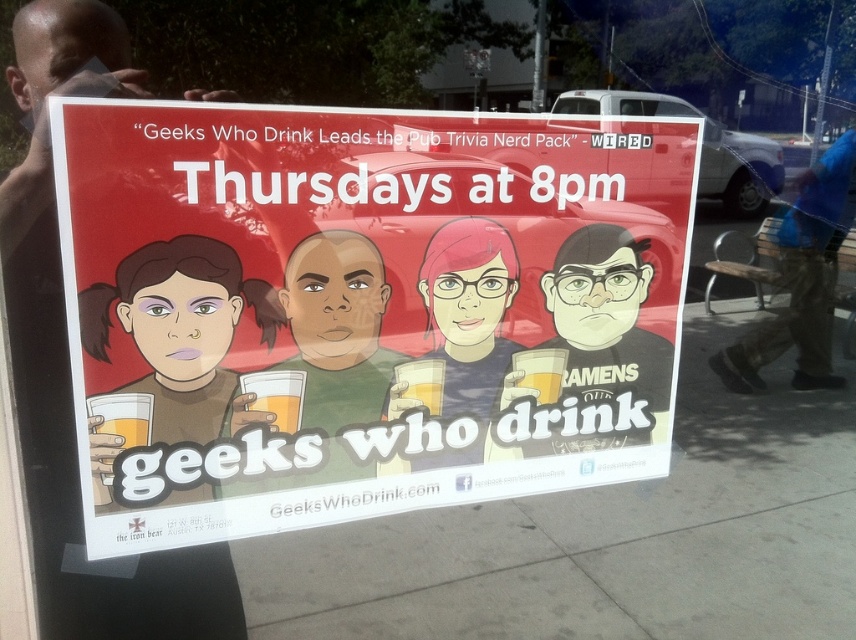
Question: Does translucent glass mug at center have a larger size compared to translucent glass beer at center?

Choices:
 (A) no
 (B) yes

Answer: (B)

Question: Which of the following is the farthest from the observer?

Choices:
 (A) (147, 264)
 (B) (333, 374)
 (C) (288, 432)

Answer: (B)

Question: Can you confirm if brown matte shirt at center is smaller than translucent plastic cup at center?

Choices:
 (A) no
 (B) yes

Answer: (A)

Question: Which of these objects is positioned farthest from the matte black shirt at center?

Choices:
 (A) matte paper poster at center
 (B) green matte shirt at center
 (C) translucent plastic cup at center
 (D) brown matte shirt at center

Answer: (D)

Question: Is the position of green matte shirt at center less distant than that of matte black shirt at center?

Choices:
 (A) no
 (B) yes

Answer: (B)

Question: Which object is closer to the camera taking this photo?

Choices:
 (A) blue fabric bag at right
 (B) matte black shirt at center
 (C) green matte shirt at center

Answer: (C)